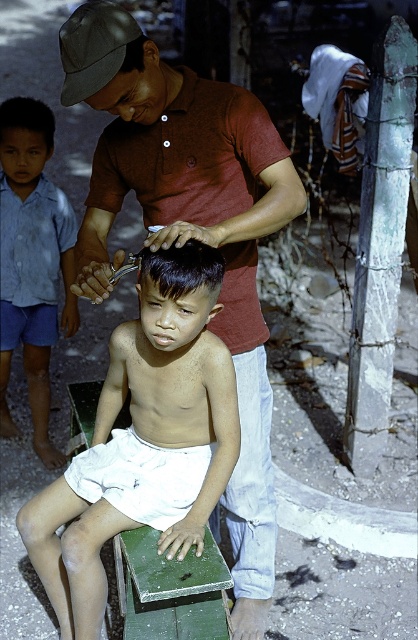
You are standing at the origin point of the image. The blue cotton shirt at left is located at point (32,260). Can you tell me the direction of the blue cotton shirt at left relative to your current position?

The blue cotton shirt at left is located at point (32,260), which is to the right and slightly below the origin point.

You are a photographer standing 10 feet away from the scene. You want to take a closeup photo of the smooth skin boy at center without including the matte maroon shirt at center in the frame. Is this possible given their distance?

The matte maroon shirt at center is 13.85 inches from the smooth skin boy at center. Since the photographer is 10 feet away, adjusting the camera angle or zooming in could allow capturing the smooth skin boy at center without the matte maroon shirt at center appearing in the frame, as their separation is relatively small compared to the distance.

You are standing in the scene and want to move from the point at coordinates point (x=213, y=529) to the point at coordinates point (x=65, y=582). Which direction should you move in?

You should move downward and to the right because point (x=65, y=582) is located below and to the right of point (x=213, y=529).